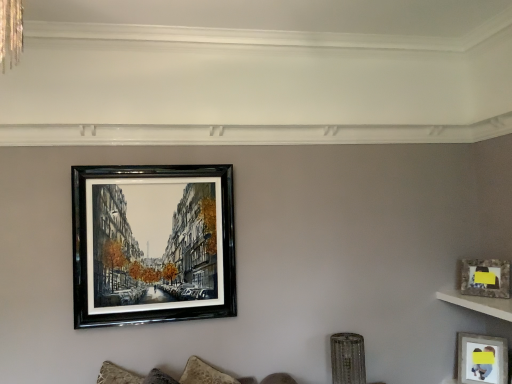
Question: Does matte gray picture frame at lower right, which ranks as the 1th picture frame in bottom-to-top order, lie behind matte glass picture frame at upper right, the second picture frame positioned from the bottom?

Choices:
 (A) yes
 (B) no

Answer: (A)

Question: Can you confirm if matte gray picture frame at lower right, the first picture frame viewed from the right, is positioned to the right of matte glass picture frame at upper right, the 2th picture frame viewed from the top?

Choices:
 (A) yes
 (B) no

Answer: (A)

Question: Considering the relative sizes of matte gray picture frame at lower right, which ranks as the 3th picture frame in top-to-bottom order, and matte glass picture frame at upper right, the 2th picture frame viewed from the top, in the image provided, is matte gray picture frame at lower right, which ranks as the 3th picture frame in top-to-bottom order, wider than matte glass picture frame at upper right, the 2th picture frame viewed from the top,?

Choices:
 (A) yes
 (B) no

Answer: (A)

Question: Considering the relative sizes of matte gray picture frame at lower right, the first picture frame viewed from the right, and matte glass picture frame at upper right, placed as the 2th picture frame when sorted from right to left, in the image provided, is matte gray picture frame at lower right, the first picture frame viewed from the right, shorter than matte glass picture frame at upper right, placed as the 2th picture frame when sorted from right to left,?

Choices:
 (A) no
 (B) yes

Answer: (A)

Question: Can you confirm if matte gray picture frame at lower right, the first picture frame viewed from the right, is smaller than matte glass picture frame at upper right, the 2th picture frame viewed from the top?

Choices:
 (A) yes
 (B) no

Answer: (B)

Question: Considering their positions, is matte gray picture frame at lower right, which ranks as the 1th picture frame in bottom-to-top order, located in front of or behind white marble shelf at upper right?

Choices:
 (A) front
 (B) behind

Answer: (B)

Question: From the image's perspective, is matte gray picture frame at lower right, arranged as the third picture frame when viewed from the left, positioned above or below white marble shelf at upper right?

Choices:
 (A) above
 (B) below

Answer: (B)

Question: Considering the positions of matte gray picture frame at lower right, the first picture frame viewed from the right, and white marble shelf at upper right in the image, is matte gray picture frame at lower right, the first picture frame viewed from the right, bigger or smaller than white marble shelf at upper right?

Choices:
 (A) small
 (B) big

Answer: (B)

Question: In terms of width, does matte gray picture frame at lower right, which ranks as the 1th picture frame in bottom-to-top order, look wider or thinner when compared to white marble shelf at upper right?

Choices:
 (A) thin
 (B) wide

Answer: (A)

Question: Considering the positions of point (474, 380) and point (499, 266), is point (474, 380) closer or farther from the camera than point (499, 266)?

Choices:
 (A) farther
 (B) closer

Answer: (A)

Question: Considering the positions of matte gray picture frame at lower right, which ranks as the 1th picture frame in bottom-to-top order, and matte glass picture frame at upper right, the 2th picture frame viewed from the top, in the image, is matte gray picture frame at lower right, which ranks as the 1th picture frame in bottom-to-top order, taller or shorter than matte glass picture frame at upper right, the 2th picture frame viewed from the top,?

Choices:
 (A) tall
 (B) short

Answer: (A)

Question: From the image's perspective, is matte gray picture frame at lower right, the first picture frame viewed from the right, located above or below matte glass picture frame at upper right, the second picture frame positioned from the bottom?

Choices:
 (A) below
 (B) above

Answer: (A)

Question: Considering the positions of matte gray picture frame at lower right, which ranks as the 3th picture frame in top-to-bottom order, and matte glass picture frame at upper right, the second picture frame positioned from the bottom, in the image, is matte gray picture frame at lower right, which ranks as the 3th picture frame in top-to-bottom order, wider or thinner than matte glass picture frame at upper right, the second picture frame positioned from the bottom,?

Choices:
 (A) wide
 (B) thin

Answer: (A)

Question: Considering the positions of black glossy picture frame at upper center, the 3th picture frame positioned from the bottom, and white marble shelf at upper right in the image, is black glossy picture frame at upper center, the 3th picture frame positioned from the bottom, bigger or smaller than white marble shelf at upper right?

Choices:
 (A) big
 (B) small

Answer: (A)

Question: From their relative heights in the image, would you say black glossy picture frame at upper center, the 3th picture frame from the right, is taller or shorter than white marble shelf at upper right?

Choices:
 (A) short
 (B) tall

Answer: (B)